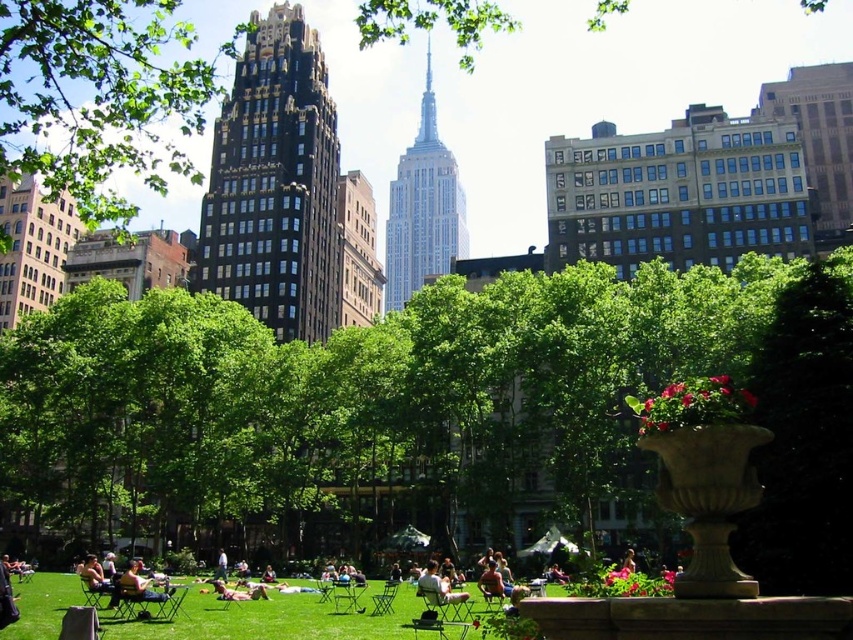
Question: Which object is closer to the camera taking this photo?

Choices:
 (A) green leafy tree at center
 (B) light brown wooden chair at lower center
 (C) matte black jacket at center

Answer: (A)

Question: In this image, where is light brown wooden chair at lower left located relative to matte black jacket at center?

Choices:
 (A) above
 (B) below

Answer: (B)

Question: Where is light brown wooden chair at center located in relation to light brown wooden chair at lower left in the image?

Choices:
 (A) right
 (B) left

Answer: (A)

Question: Which of the following is the closest to the observer?

Choices:
 (A) light brown wooden chair at center
 (B) matte black jacket at center

Answer: (A)

Question: Which object is positioned farthest from the light brown wooden chair at lower left?

Choices:
 (A) light brown wooden chair at lower center
 (B) light brown wooden chair at center
 (C) green grass at center

Answer: (B)

Question: Can you confirm if green grass at center is positioned to the left of light brown wooden chair at lower left?

Choices:
 (A) yes
 (B) no

Answer: (B)